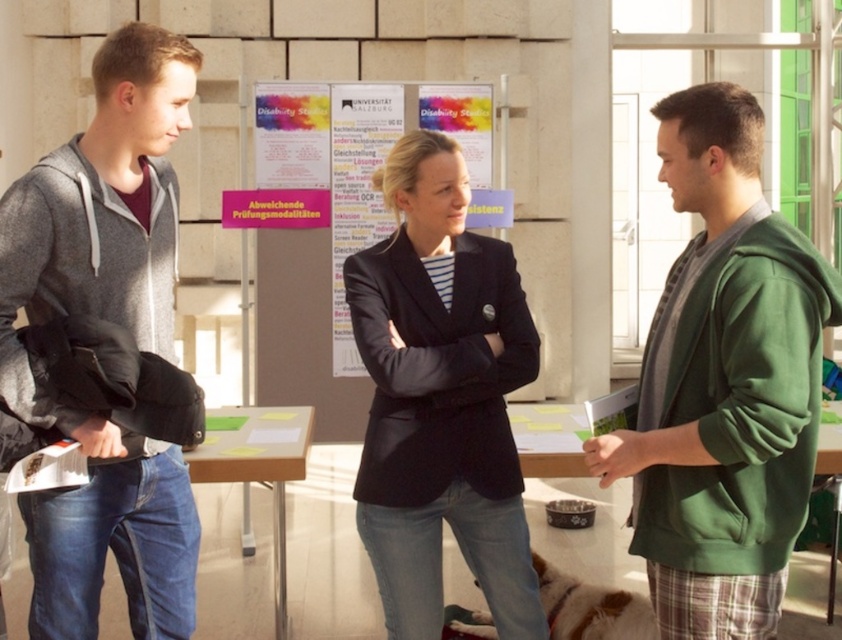
Who is lower down, green fleece jacket at right or dark blue blazer at center?

dark blue blazer at center

Can you confirm if green fleece jacket at right is thinner than dark blue blazer at center?

Yes, green fleece jacket at right is thinner than dark blue blazer at center.

Image resolution: width=842 pixels, height=640 pixels. What are the coordinates of `green fleece jacket at right` in the screenshot? It's located at (723, 384).

In the scene shown: Can you confirm if matte gray hoodie at left is smaller than matte white poster at center?

Incorrect, matte gray hoodie at left is not smaller in size than matte white poster at center.

Is point (78, 538) less distant than point (445, 109)?

Yes, it is in front of point (445, 109).

The width and height of the screenshot is (842, 640). What do you see at coordinates (110, 321) in the screenshot? I see `matte gray hoodie at left` at bounding box center [110, 321].

Image resolution: width=842 pixels, height=640 pixels. I want to click on matte gray hoodie at left, so click(x=110, y=321).

Who is positioned more to the left, matte gray hoodie at left or white paper poster at center?

matte gray hoodie at left

Is point (125, 449) positioned in front of point (388, 144)?

That is True.

Who is more forward, (x=161, y=481) or (x=360, y=189)?

Point (x=161, y=481)

Find the location of a particular element. The height and width of the screenshot is (640, 842). matte gray hoodie at left is located at coordinates (110, 321).